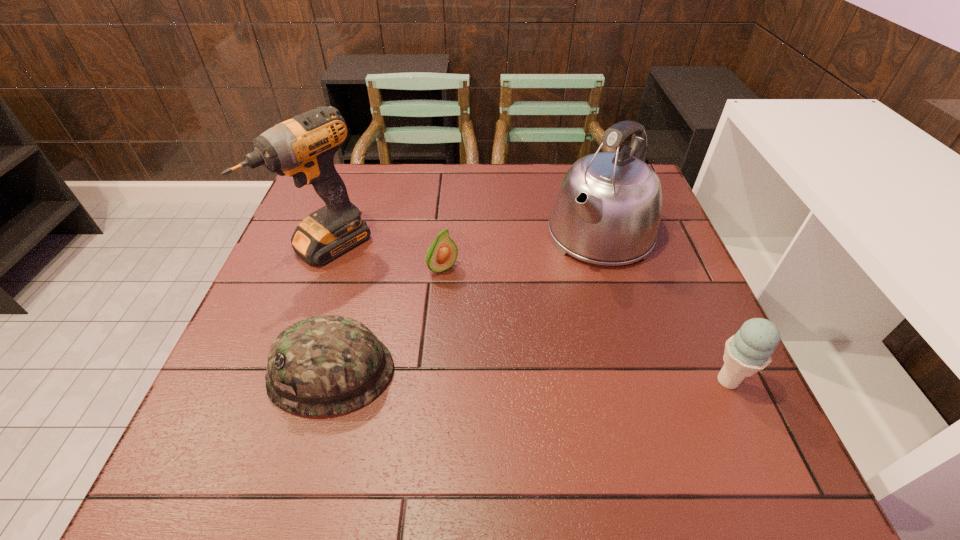
At what (x,y) coordinates should I click in order to perform the action: click on vacant space at the far left corner of the desktop. Please return your answer as a coordinate pair (x, y). The width and height of the screenshot is (960, 540). Looking at the image, I should click on (304, 200).

In the image, there is a desktop. At what (x,y) coordinates should I click in order to perform the action: click on vacant space at the near right corner. Please return your answer as a coordinate pair (x, y). Looking at the image, I should click on (686, 415).

The image size is (960, 540). I want to click on blank region between the headwear and the third object from right to left, so click(387, 320).

This screenshot has width=960, height=540. In order to click on vacant space that's between the kettle and the ice cream in this screenshot , I will do `click(664, 308)`.

You are a GUI agent. You are given a task and a screenshot of the screen. Output one action in this format:
    pyautogui.click(x=<x>, y=<y>)
    Task: Click on the free spot between the third object from left to right and the headwear
    Image resolution: width=960 pixels, height=540 pixels.
    Given the screenshot: What is the action you would take?
    pyautogui.click(x=387, y=320)

Where is `empty space between the headwear and the drill`? This screenshot has width=960, height=540. empty space between the headwear and the drill is located at coordinates (329, 309).

Where is `vacant area between the headwear and the avocado`? The image size is (960, 540). vacant area between the headwear and the avocado is located at coordinates (387, 320).

This screenshot has width=960, height=540. Find the location of `free space between the kettle and the third shortest object`. free space between the kettle and the third shortest object is located at coordinates (664, 308).

Identify the location of vacant space that's between the headwear and the kettle. The height and width of the screenshot is (540, 960). 467,303.

Locate an element on the screen. The width and height of the screenshot is (960, 540). empty location between the third tallest object and the avocado is located at coordinates (586, 325).